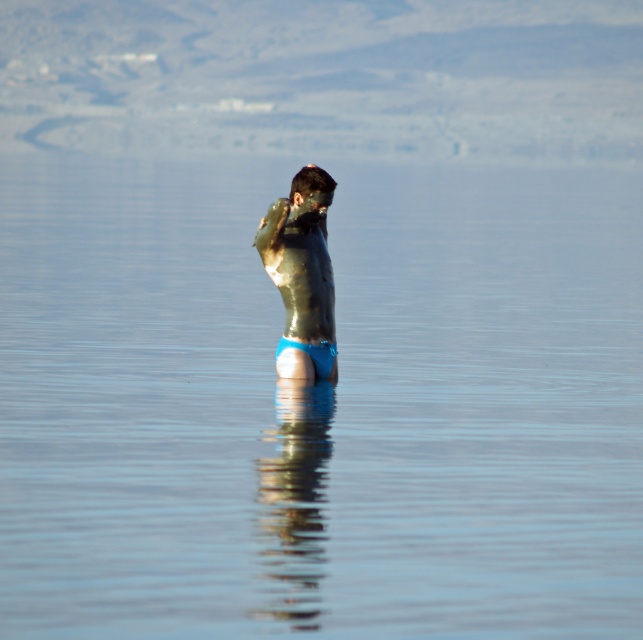
Question: Which point is farther to the camera?

Choices:
 (A) (273, 276)
 (B) (325, 356)

Answer: (B)

Question: Is shiny metallic man at center further to camera compared to blue fabric at center?

Choices:
 (A) yes
 (B) no

Answer: (B)

Question: Which point appears closest to the camera in this image?

Choices:
 (A) (320, 348)
 (B) (303, 276)

Answer: (B)

Question: Observing the image, what is the correct spatial positioning of shiny metallic man at center in reference to blue fabric at center?

Choices:
 (A) left
 (B) right

Answer: (A)

Question: Observing the image, what is the correct spatial positioning of shiny metallic man at center in reference to blue fabric at center?

Choices:
 (A) right
 (B) left

Answer: (B)